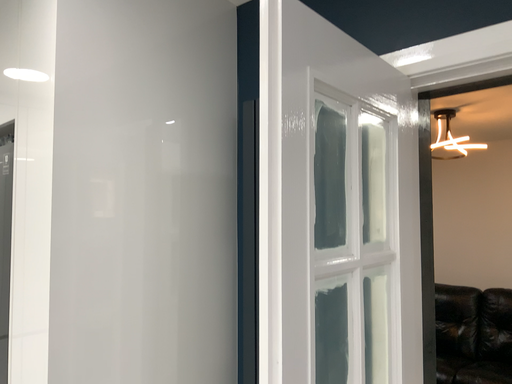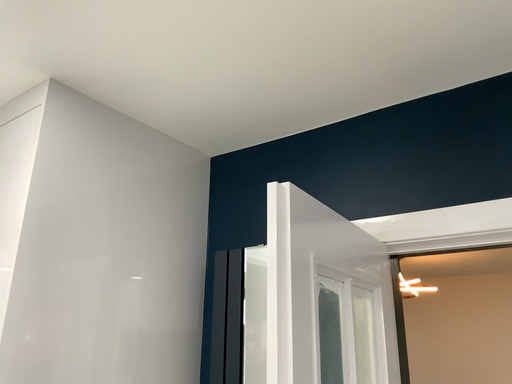
Question: How did the camera likely rotate when shooting the video?

Choices:
 (A) rotated left
 (B) rotated right

Answer: (B)